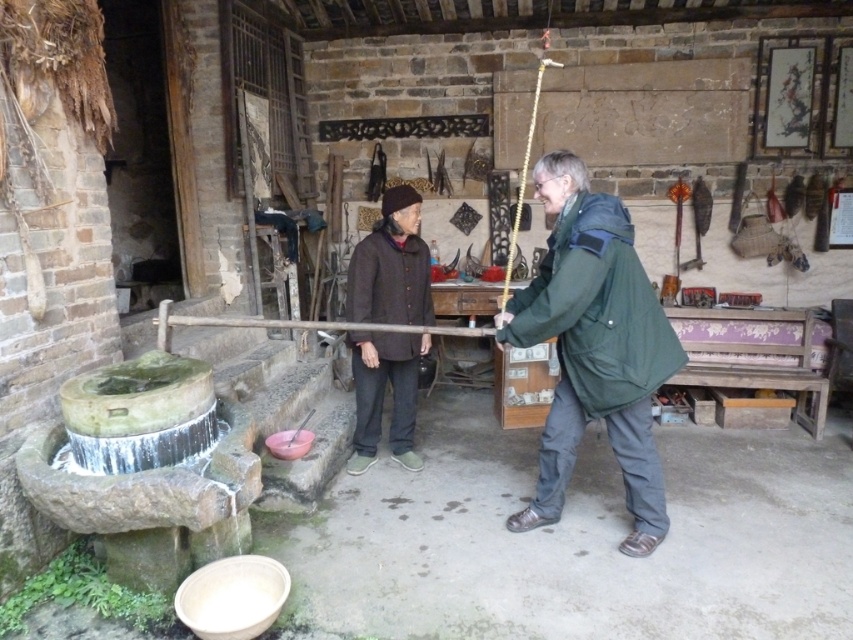
Question: Which point is closer to the camera?

Choices:
 (A) green matte jacket at center
 (B) brown woolen sweater at center

Answer: (A)

Question: Is green matte jacket at center positioned before brown woolen sweater at center?

Choices:
 (A) no
 (B) yes

Answer: (B)

Question: Which object appears farthest from the camera in this image?

Choices:
 (A) green matte jacket at center
 (B) brown woolen sweater at center

Answer: (B)

Question: Is green matte jacket at center above brown woolen sweater at center?

Choices:
 (A) yes
 (B) no

Answer: (B)

Question: Can you confirm if green matte jacket at center is positioned to the left of brown woolen sweater at center?

Choices:
 (A) yes
 (B) no

Answer: (B)